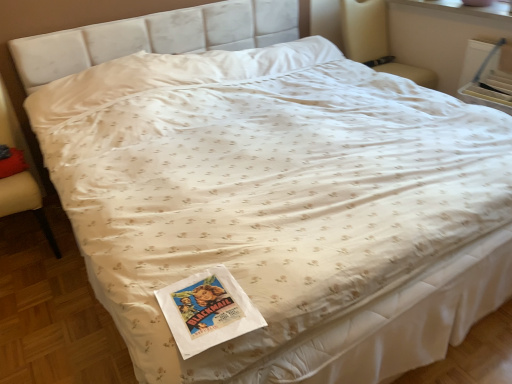
Question: From the image's perspective, is velvet beige armchair at left, placed as the 1th armchair when sorted from front to back, located above or below beige fabric armchair at upper right, which is the 2th armchair from left to right?

Choices:
 (A) below
 (B) above

Answer: (A)

Question: Does point (8, 205) appear closer or farther from the camera than point (381, 28)?

Choices:
 (A) closer
 (B) farther

Answer: (A)

Question: Which is farther from the velvet beige armchair at left, arranged as the 2th armchair when viewed from the top?

Choices:
 (A) beige fabric armchair at upper right, the first armchair positioned from the right
 (B) red cotton pillow at lower left

Answer: (A)

Question: Based on their relative distances, which object is nearer to the velvet beige armchair at left, the first armchair when ordered from bottom to top?

Choices:
 (A) red cotton pillow at lower left
 (B) beige fabric armchair at upper right, the first armchair from the top

Answer: (A)